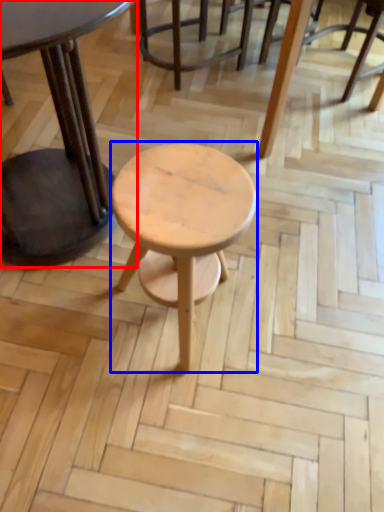
Question: Which object appears closest to the camera in this image, table (highlighted by a red box) or stool (highlighted by a blue box)?

Choices:
 (A) table
 (B) stool

Answer: (A)